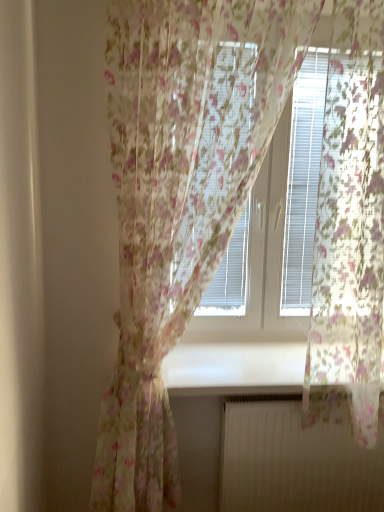
At what (x,y) coordinates should I click in order to perform the action: click on white glossy window sill at center. Please return your answer as a coordinate pair (x, y). This screenshot has width=384, height=512. Looking at the image, I should click on (235, 368).

The height and width of the screenshot is (512, 384). Describe the element at coordinates (235, 368) in the screenshot. I see `white glossy window sill at center` at that location.

The height and width of the screenshot is (512, 384). I want to click on white matte radiator at lower center, so click(x=298, y=456).

Where is `white plastic blinds at upper center`? white plastic blinds at upper center is located at coordinates (303, 182).

Find the location of a particular element. The height and width of the screenshot is (512, 384). white glossy window sill at center is located at coordinates (235, 368).

Between white matte radiator at lower center and white plastic blinds at upper center, which one has smaller size?

With smaller size is white matte radiator at lower center.

Between point (349, 502) and point (300, 307), which one is positioned behind?

The point (300, 307) is more distant.

From a real-world perspective, is white matte radiator at lower center physically above white plastic blinds at upper center?

No, from a real-world perspective, white matte radiator at lower center is not over white plastic blinds at upper center

Can you tell me how much white matte radiator at lower center and white plastic blinds at upper center differ in facing direction?

0.315 degrees separate the facing orientations of white matte radiator at lower center and white plastic blinds at upper center.

Can you confirm if white plastic blinds at upper center is bigger than white matte radiator at lower center?

Indeed, white plastic blinds at upper center has a larger size compared to white matte radiator at lower center.

Does white plastic blinds at upper center have a greater width compared to white matte radiator at lower center?

Yes, white plastic blinds at upper center is wider than white matte radiator at lower center.

From a real-world perspective, is white plastic blinds at upper center on top of white matte radiator at lower center?

Correct, in the physical world, white plastic blinds at upper center is higher than white matte radiator at lower center.

Is white plastic blinds at upper center not near white matte radiator at lower center?

No, white plastic blinds at upper center is not far away from white matte radiator at lower center.

How much distance is there between white glossy window sill at center and white matte radiator at lower center?

10.40 inches.

Considering the relative sizes of white glossy window sill at center and white matte radiator at lower center in the image provided, is white glossy window sill at center shorter than white matte radiator at lower center?

Indeed, white glossy window sill at center has a lesser height compared to white matte radiator at lower center.

Considering the positions of objects white glossy window sill at center and white matte radiator at lower center in the image provided, who is more to the right, white glossy window sill at center or white matte radiator at lower center?

From the viewer's perspective, white matte radiator at lower center appears more on the right side.

Can you confirm if white glossy window sill at center is wider than white matte radiator at lower center?

Indeed, white glossy window sill at center has a greater width compared to white matte radiator at lower center.

What are the coordinates of `window sill above the white matte radiator at lower center (from a real-world perspective)` in the screenshot? It's located at (235, 368).

Considering the sizes of white matte radiator at lower center and white glossy window sill at center in the image, is white matte radiator at lower center bigger or smaller than white glossy window sill at center?

Considering their sizes, white matte radiator at lower center takes up less space than white glossy window sill at center.

Which object is further away from the camera taking this photo, white matte radiator at lower center or white glossy window sill at center?

white matte radiator at lower center is more distant.

Is white matte radiator at lower center placed right next to white glossy window sill at center?

No, white matte radiator at lower center is not beside white glossy window sill at center.

From the image's perspective, between white plastic blinds at upper center and white glossy window sill at center, who is located below?

white glossy window sill at center is shown below in the image.

From a real-world perspective, is white plastic blinds at upper center positioned above or below white glossy window sill at center?

white plastic blinds at upper center is situated higher than white glossy window sill at center in the real world.

In the image, is white plastic blinds at upper center positioned in front of or behind white glossy window sill at center?

Clearly, white plastic blinds at upper center is in front of white glossy window sill at center.

Is point (320, 84) in front of point (248, 361)?

No.

From a real-world perspective, which is physically above, white glossy window sill at center or white plastic blinds at upper center?

From a 3D spatial view, white plastic blinds at upper center is above.

Can you see white glossy window sill at center touching white plastic blinds at upper center?

white glossy window sill at center is not next to white plastic blinds at upper center, and they're not touching.

Who is shorter, white glossy window sill at center or white plastic blinds at upper center?

Standing shorter between the two is white glossy window sill at center.

Find the location of a particular element. blind lying on the right of white matte radiator at lower center is located at coordinates (303, 182).

This screenshot has height=512, width=384. In order to click on blind above the white matte radiator at lower center (from a real-world perspective) in this screenshot , I will do `click(303, 182)`.

Based on their spatial positions, is white glossy window sill at center or white matte radiator at lower center closer to white plastic blinds at upper center?

white glossy window sill at center is positioned closer to the anchor white plastic blinds at upper center.

Which object lies nearer to the anchor point white matte radiator at lower center, white glossy window sill at center or white plastic blinds at upper center?

Based on the image, white glossy window sill at center appears to be nearer to white matte radiator at lower center.

Looking at the image, which one is located further to white glossy window sill at center, white plastic blinds at upper center or white matte radiator at lower center?

white plastic blinds at upper center is positioned further to the anchor white glossy window sill at center.

Based on their spatial positions, is white plastic blinds at upper center or white glossy window sill at center further from white matte radiator at lower center?

white plastic blinds at upper center.

From the image, which object appears to be farther from white plastic blinds at upper center, white matte radiator at lower center or white glossy window sill at center?

Among the two, white matte radiator at lower center is located further to white plastic blinds at upper center.

Estimate the real-world distances between objects in this image. Which object is further from white glossy window sill at center, white matte radiator at lower center or white plastic blinds at upper center?

The object further to white glossy window sill at center is white plastic blinds at upper center.

At what (x,y) coordinates should I click in order to perform the action: click on window sill between white plastic blinds at upper center and white matte radiator at lower center in the vertical direction. Please return your answer as a coordinate pair (x, y). Image resolution: width=384 pixels, height=512 pixels. Looking at the image, I should click on (235, 368).